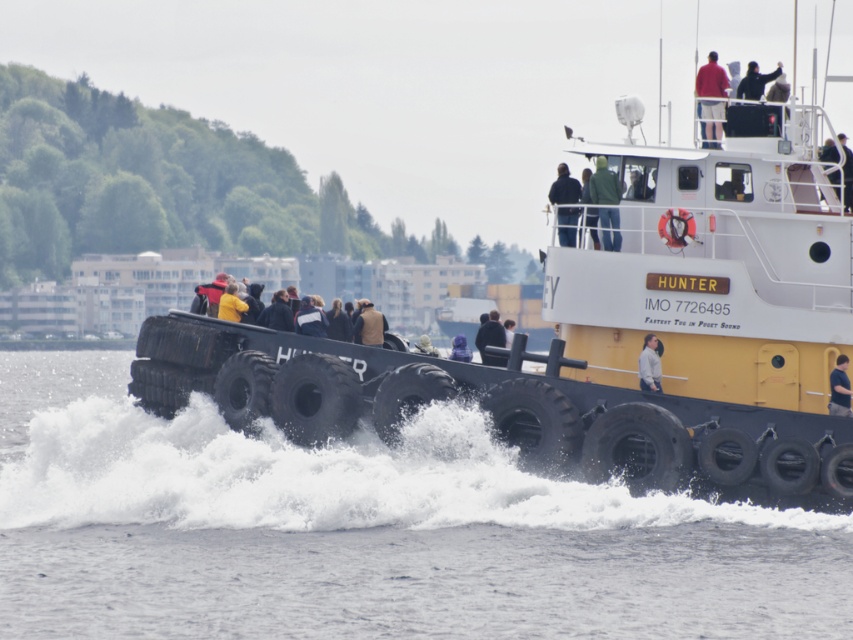
You are a photographer trying to capture the tugboat Hunter from the deck. You notice two points marked on your camera screen at coordinates point [718,106] and point [479,346]. Which point will appear larger in your photo?

Point [718,106] is closer to the camera than point [479,346], so it will appear larger in the photo.

You are a safety inspector on the tugboat Hunter. You need to ensure that the light brown leather jacket at center is at least 20 meters away from the white frothy water at lower center to prevent it from being swept overboard. Based on the scene, is the jacket in a safe position?

The light brown leather jacket at center and white frothy water at lower center are 19.08 meters apart. Since the required distance is 20 meters, the jacket is not positioned safely and is too close to the frothy water.

You are a photographer on the tugboat named Hunter. You notice two jackets on the deck. One is the dark blue jacket at upper center and the other is the black matte jacket at upper right. Which jacket is positioned lower on the deck?

The dark blue jacket at upper center is positioned lower on the deck than the black matte jacket at upper right.